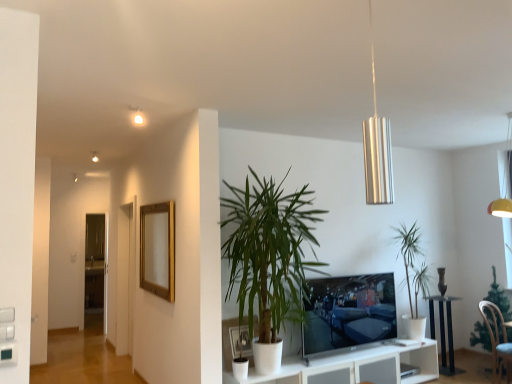
Question: From a real-world perspective, relative to green leafy plant at lower right, acting as the 3th houseplant starting from the left, is light blue fabric chair at lower right vertically above or below?

Choices:
 (A) above
 (B) below

Answer: (B)

Question: Based on their positions, is light blue fabric chair at lower right located to the left or right of green leafy plant at lower right, acting as the 3th houseplant starting from the left?

Choices:
 (A) left
 (B) right

Answer: (A)

Question: Estimate the real-world distances between objects in this image. Which object is closer to the white matte picture frame at lower center, arranged as the 1th picture frame when viewed from the front?

Choices:
 (A) green leafy plant at center, positioned as the third houseplant in right-to-left order
 (B) gold wooden picture frame at upper left, positioned as the first picture frame in top-to-bottom order
 (C) black glossy table at lower right
 (D) flat screen tv at center
 (E) green leafy plant at lower right, acting as the 3th houseplant starting from the left

Answer: (A)

Question: Considering the real-world distances, which object is closest to the gold wooden picture frame at upper left, positioned as the first picture frame in top-to-bottom order?

Choices:
 (A) green leafy plant at center, positioned as the third houseplant in right-to-left order
 (B) flat screen tv at center
 (C) light blue fabric chair at lower right
 (D) black glossy table at lower right
 (E) transparent glass door at left

Answer: (A)